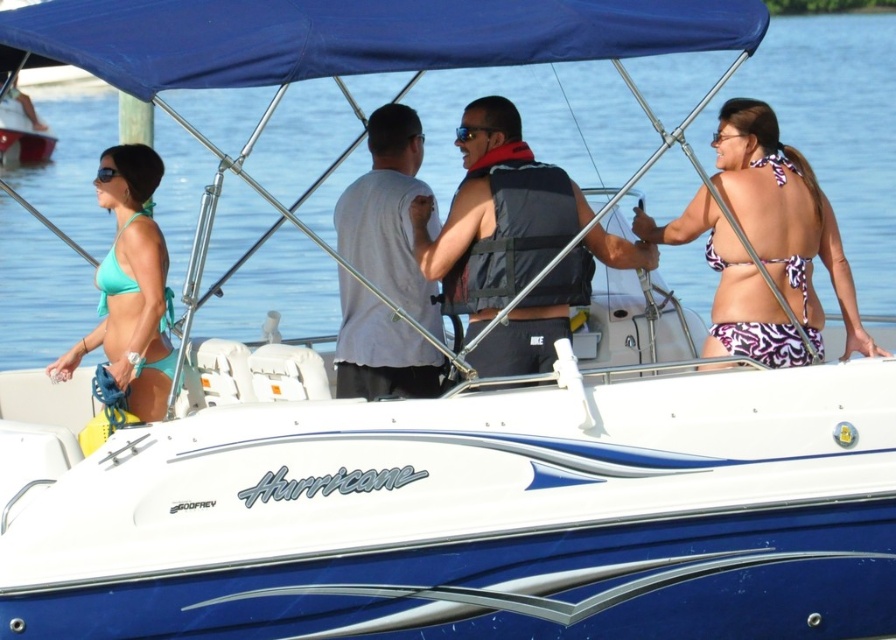
Does dark gray life vest at center have a greater height compared to purple printed bikini top at right?

No, dark gray life vest at center is not taller than purple printed bikini top at right.

Does dark gray life vest at center have a lesser width compared to purple printed bikini top at right?

Yes.

Does point (550, 221) lie behind point (765, 192)?

No, it is in front of (765, 192).

This screenshot has height=640, width=896. I want to click on dark gray life vest at center, so coord(495,216).

Between purple printed bikini top at right and gray cotton t-shirt at center, which one is positioned higher?

Positioned higher is purple printed bikini top at right.

Can you confirm if purple printed bikini top at right is positioned below gray cotton t-shirt at center?

Incorrect, purple printed bikini top at right is not positioned below gray cotton t-shirt at center.

What do you see at coordinates (784, 218) in the screenshot? I see `purple printed bikini top at right` at bounding box center [784, 218].

In order to click on purple printed bikini top at right in this screenshot , I will do `click(784, 218)`.

This screenshot has height=640, width=896. What do you see at coordinates (495, 216) in the screenshot?
I see `dark gray life vest at center` at bounding box center [495, 216].

Does point (502, 131) come behind point (100, 272)?

That is False.

Image resolution: width=896 pixels, height=640 pixels. Find the location of `dark gray life vest at center`. dark gray life vest at center is located at coordinates (495, 216).